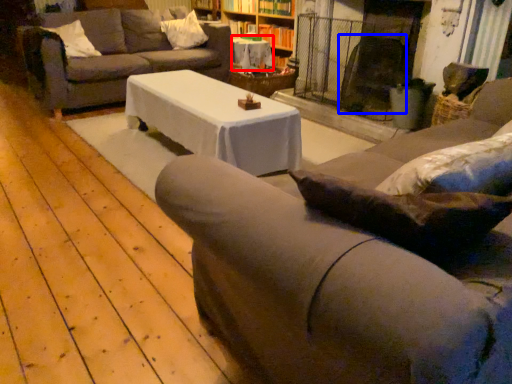
Question: Which of the following is the closest to the observer, table (highlighted by a red box) or swivel chair (highlighted by a blue box)?

Choices:
 (A) table
 (B) swivel chair

Answer: (B)